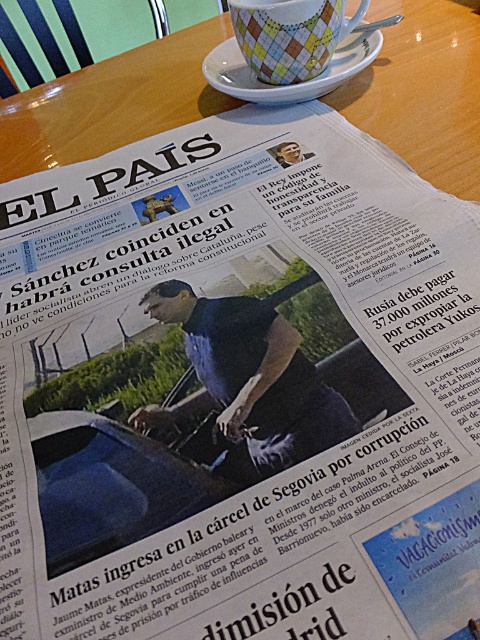
Who is positioned more to the right, wooden table at center or white ceramic saucer at upper center?

From the viewer's perspective, white ceramic saucer at upper center appears more on the right side.

Is point (115, 81) less distant than point (271, 86)?

No, it is behind (271, 86).

Which is in front, point (418, 13) or point (369, 48)?

Point (369, 48) is more forward.

This screenshot has width=480, height=640. I want to click on wooden table at center, so click(x=111, y=102).